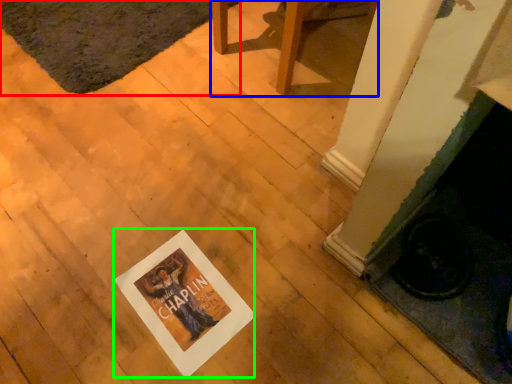
Question: Based on their relative distances, which object is farther from mat (highlighted by a red box)? Choose from furniture (highlighted by a blue box) and postcard (highlighted by a green box).

Choices:
 (A) furniture
 (B) postcard

Answer: (B)